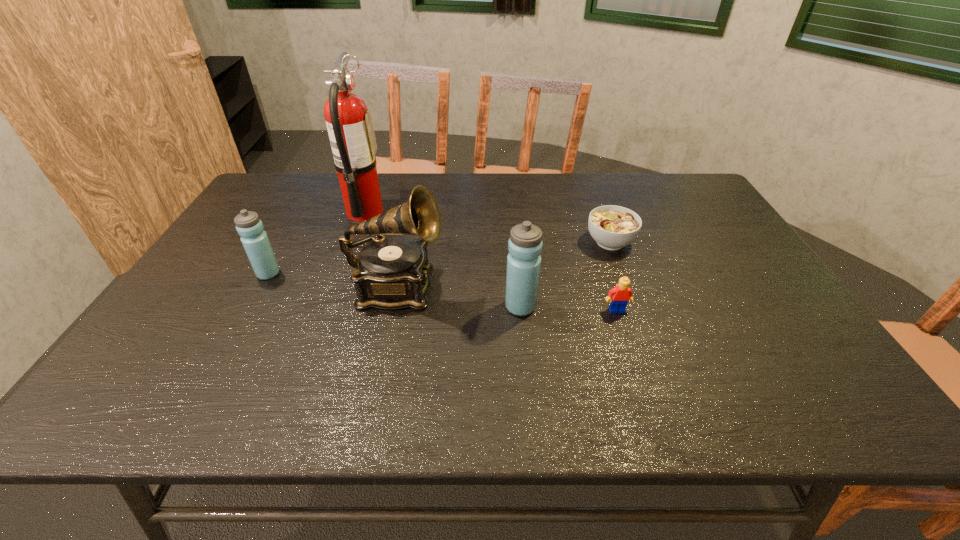
Where is `the shorter water bottle`? The image size is (960, 540). the shorter water bottle is located at coordinates (255, 241).

Find the location of `the fourth tallest object`. the fourth tallest object is located at coordinates (255, 241).

The image size is (960, 540). I want to click on the right water bottle, so click(525, 244).

This screenshot has height=540, width=960. I want to click on the fourth object from left to right, so click(525, 244).

This screenshot has width=960, height=540. What are the coordinates of `soup bowl` in the screenshot? It's located at (613, 227).

Where is `fire extinguisher`? The width and height of the screenshot is (960, 540). fire extinguisher is located at coordinates (349, 123).

Image resolution: width=960 pixels, height=540 pixels. Find the location of `the second shortest object`. the second shortest object is located at coordinates (621, 294).

This screenshot has height=540, width=960. What are the coordinates of `phonograph record` in the screenshot? It's located at (392, 272).

Identify the location of blank space located 0.080m on the back of the farther water bottle. Image resolution: width=960 pixels, height=540 pixels. (282, 249).

Where is `free spot located on the left of the nearer water bottle`? The image size is (960, 540). free spot located on the left of the nearer water bottle is located at coordinates (384, 307).